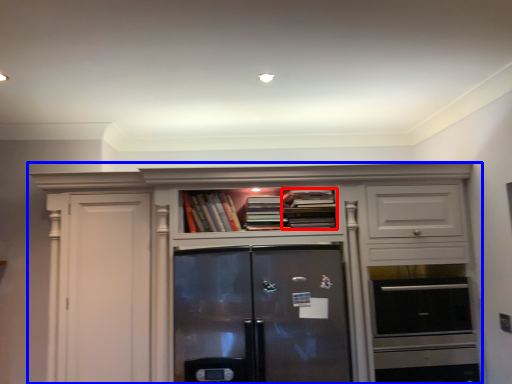
Question: Which object appears closest to the camera in this image, book (highlighted by a red box) or cabinetry (highlighted by a blue box)?

Choices:
 (A) book
 (B) cabinetry

Answer: (B)